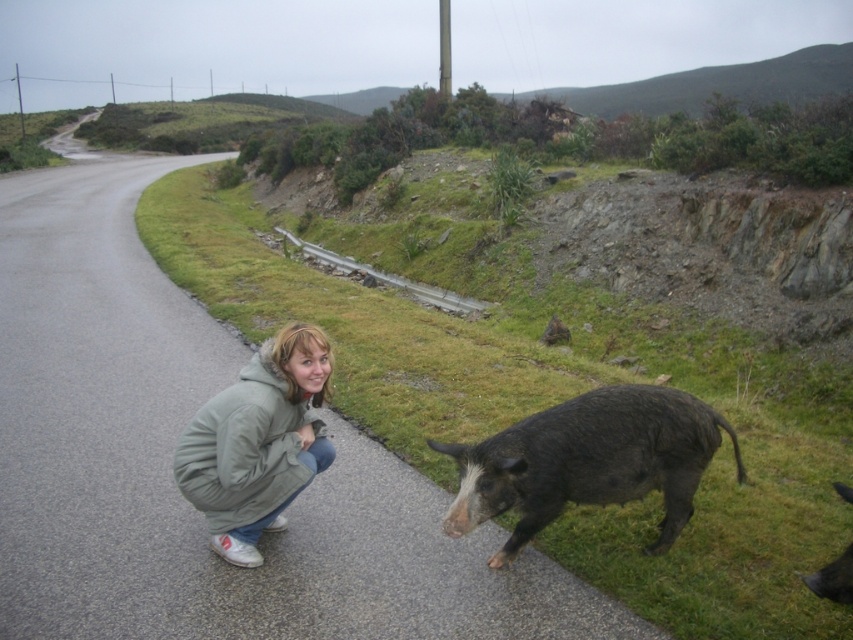
Which is below, dark brown fur pig at road center or dark brown fur at lower right?

dark brown fur at lower right

What do you see at coordinates (589, 461) in the screenshot?
I see `dark brown fur pig at road center` at bounding box center [589, 461].

You are a GUI agent. You are given a task and a screenshot of the screen. Output one action in this format:
    pyautogui.click(x=<x>, y=<y>)
    Task: Click on the dark brown fur pig at road center
    The image size is (853, 640).
    Given the screenshot: What is the action you would take?
    pyautogui.click(x=589, y=461)

Does green fuzzy jacket at lower left come in front of dark brown fur at lower right?

No, green fuzzy jacket at lower left is behind dark brown fur at lower right.

Who is more distant from viewer, (x=282, y=468) or (x=839, y=596)?

The point (x=282, y=468) is more distant.

Between point (259, 406) and point (831, 579), which one is positioned behind?

The point (259, 406) is behind.

Find the location of a particular element. The image size is (853, 640). green fuzzy jacket at lower left is located at coordinates (258, 442).

Between point (663, 465) and point (186, 474), which one is positioned in front?

Point (186, 474) is in front.

Looking at this image, who is higher up, dark brown fur pig at road center or green fuzzy jacket at lower left?

Positioned higher is green fuzzy jacket at lower left.

Which is in front, point (633, 486) or point (241, 426)?

Point (241, 426) is in front.

The width and height of the screenshot is (853, 640). What are the coordinates of `dark brown fur pig at road center` in the screenshot? It's located at (589, 461).